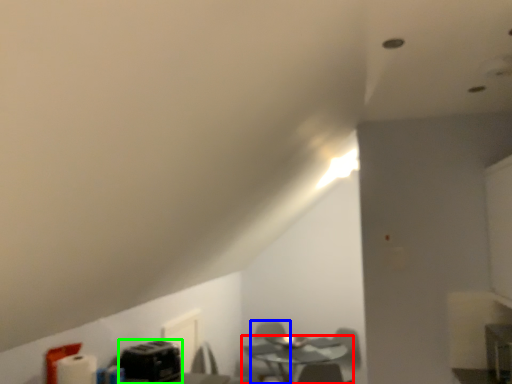
Question: Estimate the real-world distances between objects in this image. Which object is farther from table (highlighted by a red box), swivel chair (highlighted by a blue box) or appliance (highlighted by a green box)?

Choices:
 (A) swivel chair
 (B) appliance

Answer: (B)